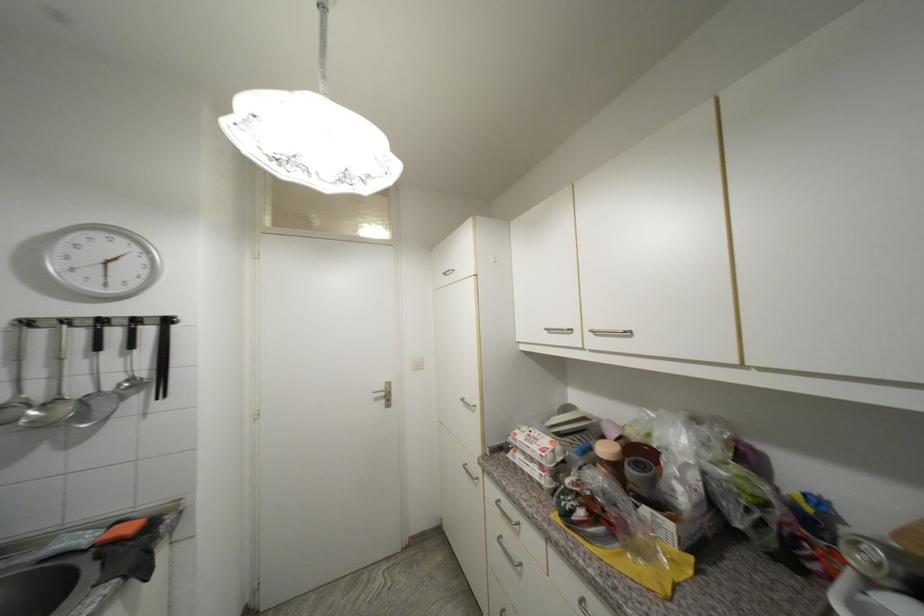
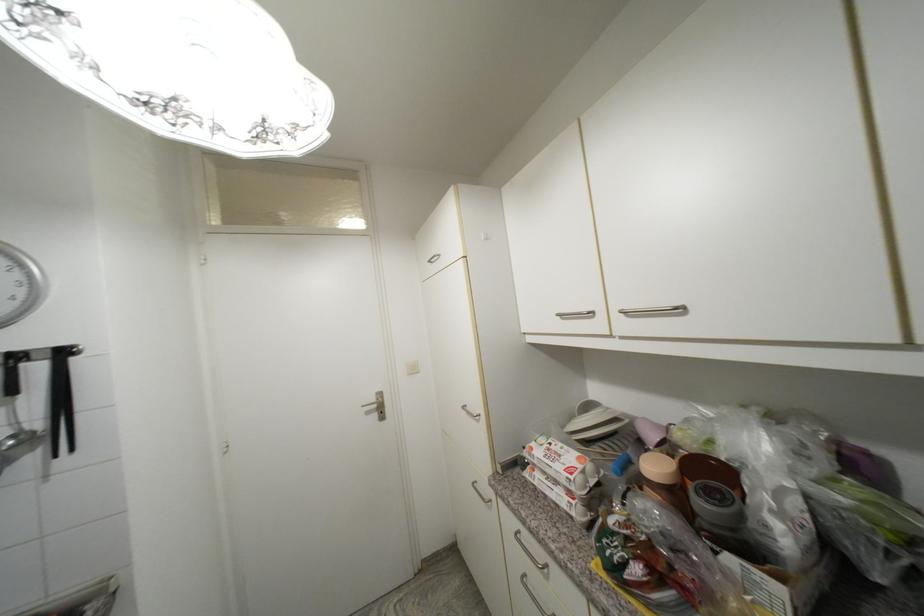
Question: The images are taken continuously from a first-person perspective. In which direction are you moving?

Choices:
 (A) Left
 (B) Right
 (C) Forward
 (D) Backward

Answer: (C)